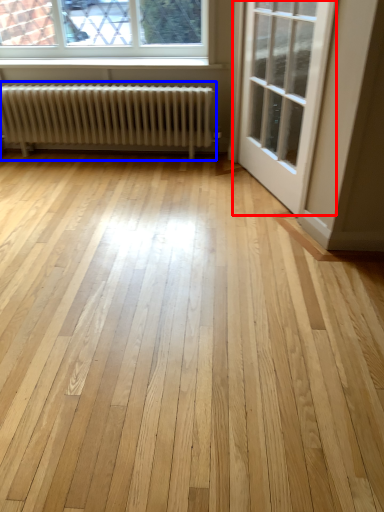
Question: Which point is further to the camera, door (highlighted by a red box) or radiator (highlighted by a blue box)?

Choices:
 (A) door
 (B) radiator

Answer: (B)